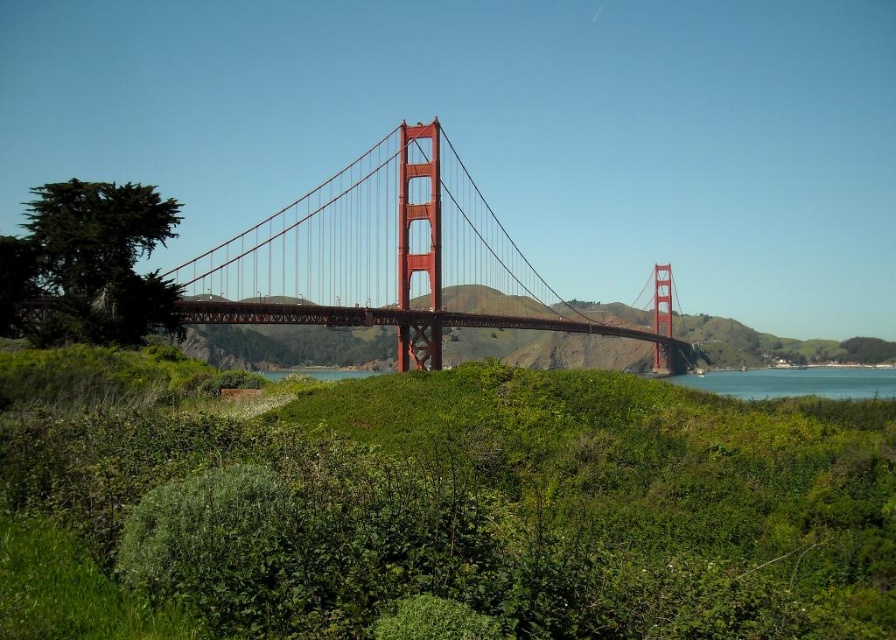
Who is shorter, green leafy shrubs at center or glossy steel bridge at center?

green leafy shrubs at center

How distant is green leafy shrubs at center from glossy steel bridge at center?

green leafy shrubs at center is 109.24 meters away from glossy steel bridge at center.

Who is more forward, (854, 536) or (464, 216)?

Point (854, 536) is in front.

At what (x,y) coordinates should I click in order to perform the action: click on green leafy shrubs at center. Please return your answer as a coordinate pair (x, y). Looking at the image, I should click on (444, 502).

Which is more to the left, green leafy tree at left or blue water at lower center?

Positioned to the left is green leafy tree at left.

Does green leafy tree at left have a larger size compared to blue water at lower center?

Actually, green leafy tree at left might be smaller than blue water at lower center.

I want to click on green leafy tree at left, so click(x=89, y=262).

Who is more forward, (x=392, y=188) or (x=90, y=337)?

Point (x=90, y=337)

Is point (336, 324) positioned in front of point (119, 182)?

No.

Locate an element on the screen. Image resolution: width=896 pixels, height=640 pixels. glossy steel bridge at center is located at coordinates (392, 259).